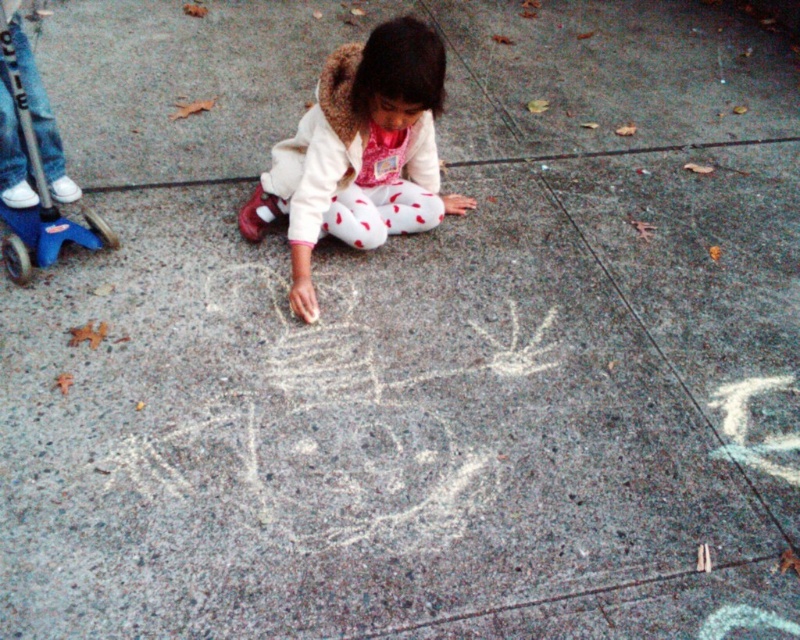
Question: Based on their relative distances, which object is nearer to the white soft fabric at center?

Choices:
 (A) white chalk drawing at center
 (B) blue rubber glove at upper left

Answer: (A)

Question: Which object is farther from the camera taking this photo?

Choices:
 (A) white chalk drawing at center
 (B) white soft fabric at center
 (C) blue rubber glove at upper left

Answer: (B)

Question: Which of these objects is positioned closest to the white soft fabric at center?

Choices:
 (A) white chalk drawing at center
 (B) blue rubber glove at upper left

Answer: (A)

Question: In this image, where is white chalk drawing at center located relative to blue rubber glove at upper left?

Choices:
 (A) right
 (B) left

Answer: (A)

Question: Is white soft fabric at center bigger than blue rubber glove at upper left?

Choices:
 (A) yes
 (B) no

Answer: (A)

Question: Does white soft fabric at center appear over blue rubber glove at upper left?

Choices:
 (A) no
 (B) yes

Answer: (A)